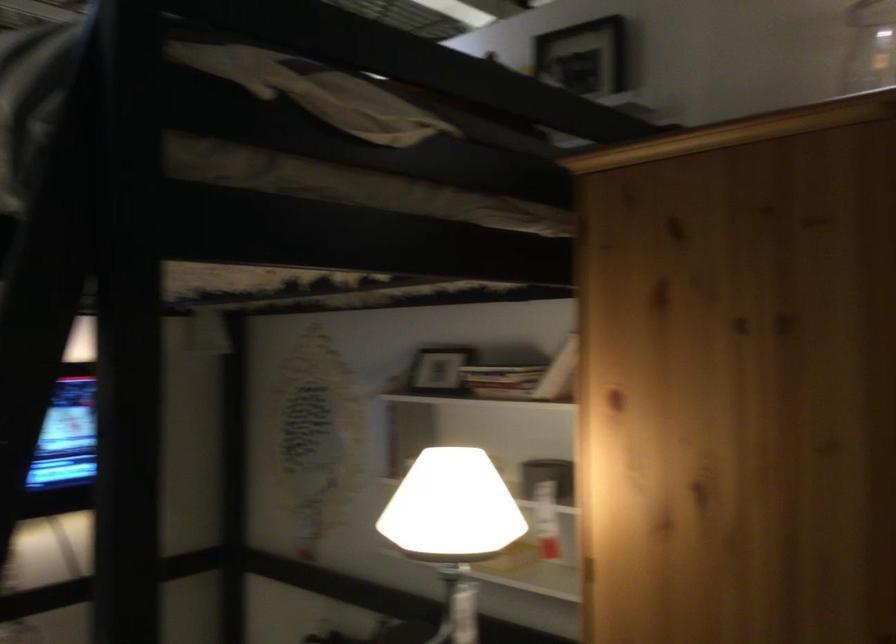
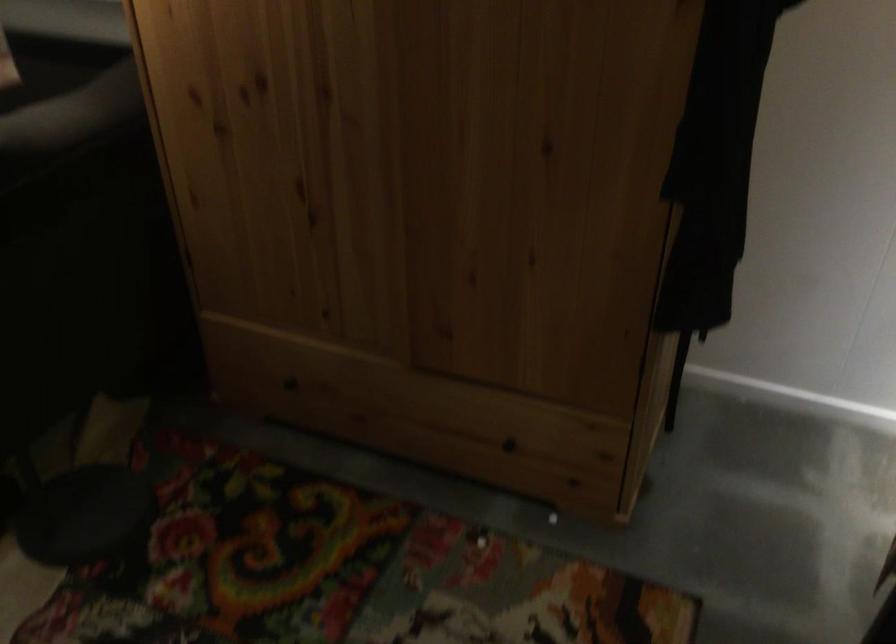
Based on the continuous images, in which direction is the camera rotating?

The camera rotated toward right-down.